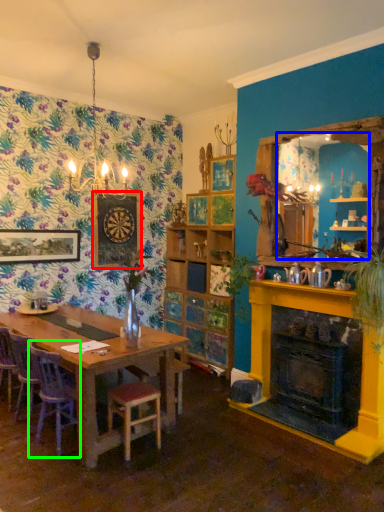
Question: Based on their relative distances, which object is nearer to picture frame (highlighted by a red box)? Choose from mirror (highlighted by a blue box) and chair (highlighted by a green box).

Choices:
 (A) mirror
 (B) chair

Answer: (B)